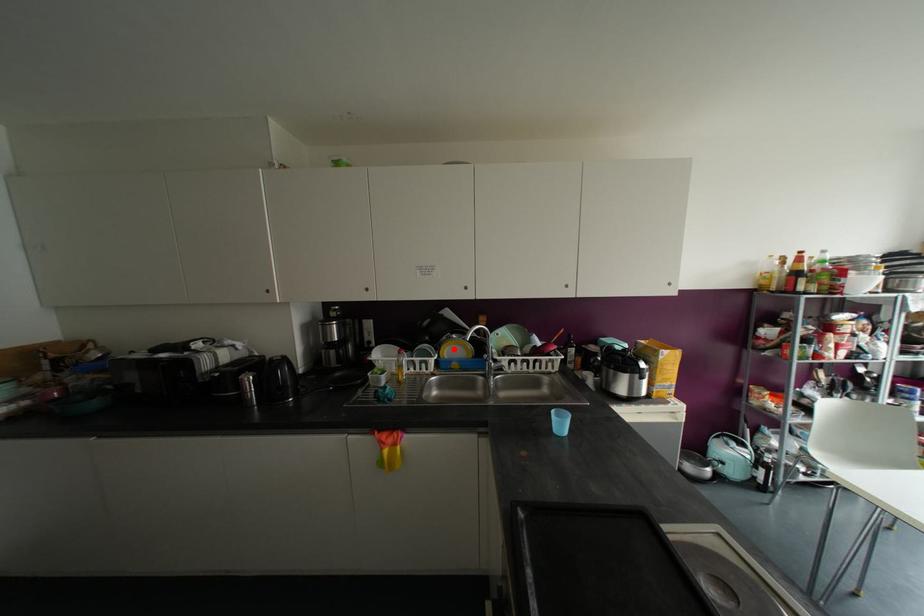
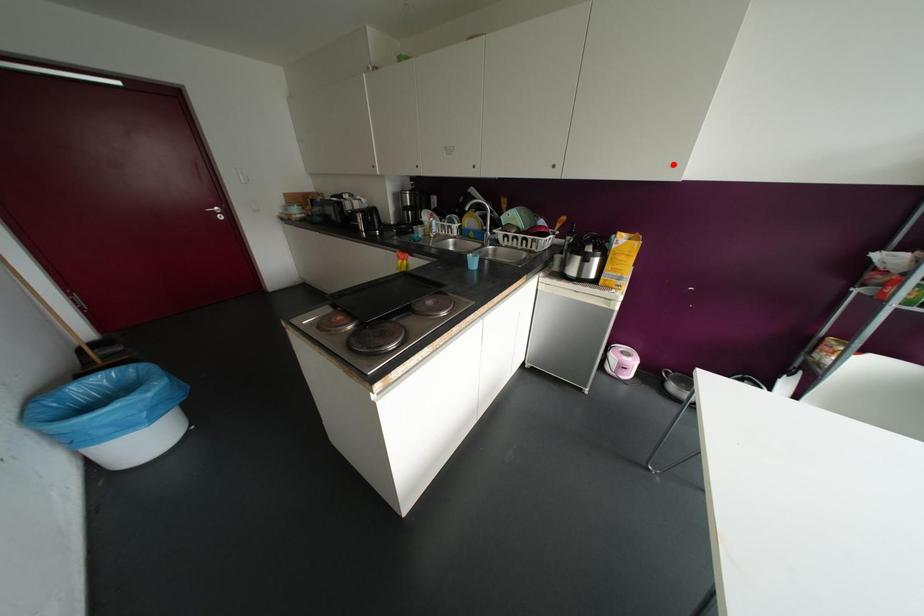
I am providing you with two images of the same scene from different viewpoints. A red point is marked on the first image and another point is marked on the second image. Do the highlighted points in image1 and image2 indicate the same real-world spot?

No